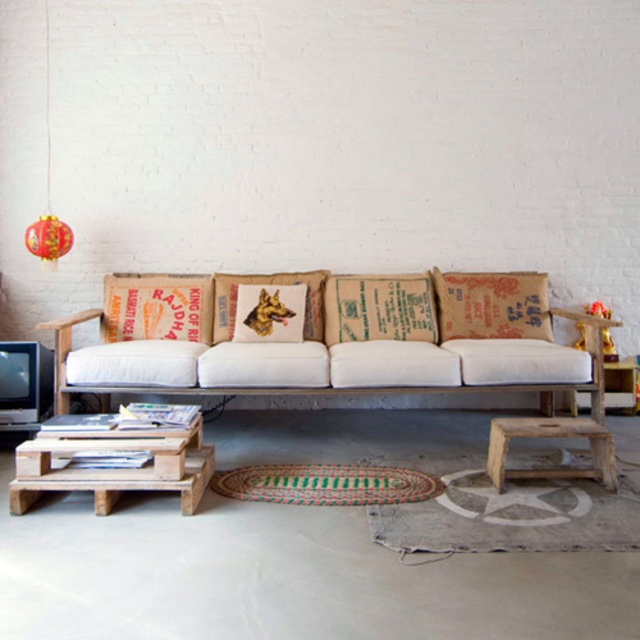
You are arranging a cozy reading corner and want to place both the brown burlap pillow at right and the orange printed fabric pillow at center on a shelf. Which pillow should you place first if the shelf can only accommodate one pillow at a time and you want to place the wider one first?

The brown burlap pillow at right might be wider than orange printed fabric pillow at center, so you should place the brown burlap pillow at right first to ensure it fits before the narrower one.

You are standing in the living room and want to move from the sofa to the entrance door. There are two points marked on the floor at coordinates point (179, 461) and point (202, 333). Which point should you step on first if you need to reach the entrance door first?

Point (179, 461) is in front of point (202, 333), so you should step on point (179, 461) first to reach the entrance door.

You are a delivery person who just arrived with a package that needs to be placed between the wooden pallets at lower left and the wooden stool at lower right. The package is 6 feet long. Can you fit the package between them?

The distance between the wooden pallets at lower left and wooden stool at lower right is 5.52 feet, which is shorter than the 6 feet length of the package. Therefore, the package cannot fit between them.